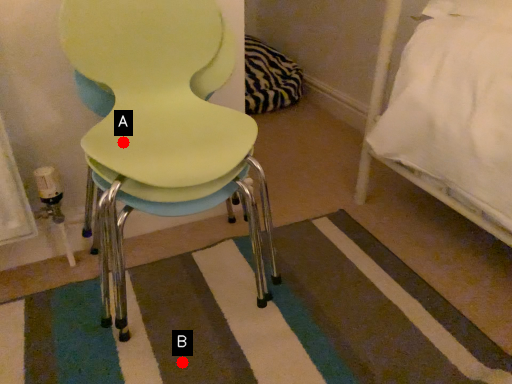
Question: Two points are circled on the image, labeled by A and B beside each circle. Which point is farther to the camera?

Choices:
 (A) A is further
 (B) B is further

Answer: (B)